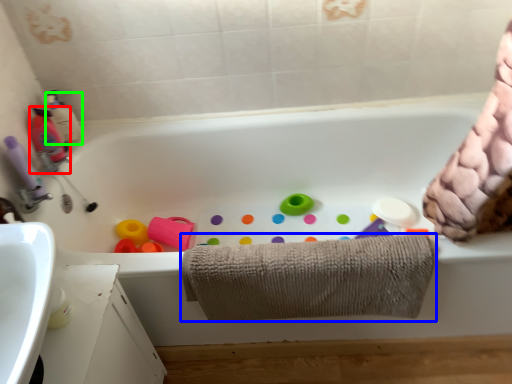
Question: Which object is the closest to the cleaning product (highlighted by a red box)? Choose among these: towel (highlighted by a blue box) or cleaning product (highlighted by a green box).

Choices:
 (A) towel
 (B) cleaning product

Answer: (B)